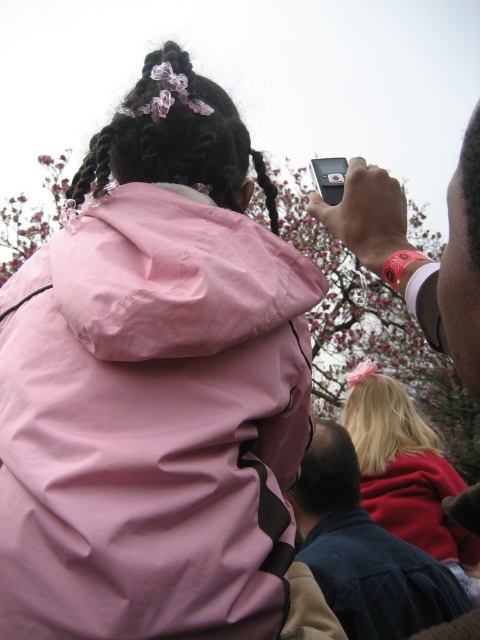
Can you confirm if blue denim jacket at lower right is positioned above pink fabric braids at upper center?

No, blue denim jacket at lower right is not above pink fabric braids at upper center.

Does blue denim jacket at lower right have a smaller size compared to pink fabric braids at upper center?

No, blue denim jacket at lower right is not smaller than pink fabric braids at upper center.

Does point (410, 605) come behind point (66, 205)?

Yes, it is.

Image resolution: width=480 pixels, height=640 pixels. Find the location of `blue denim jacket at lower right`. blue denim jacket at lower right is located at coordinates (x=363, y=550).

Is blue denim jacket at lower right taller than matte black phone at upper right?

No, blue denim jacket at lower right is not taller than matte black phone at upper right.

Does blue denim jacket at lower right lie in front of matte black phone at upper right?

No, blue denim jacket at lower right is further to the viewer.

Between point (323, 445) and point (367, 188), which one is positioned in front?

Positioned in front is point (367, 188).

At what (x,y) coordinates should I click in order to perform the action: click on blue denim jacket at lower right. Please return your answer as a coordinate pair (x, y). The height and width of the screenshot is (640, 480). Looking at the image, I should click on (363, 550).

Can you confirm if matte black phone at upper right is thinner than pink fabric braids at upper center?

In fact, matte black phone at upper right might be wider than pink fabric braids at upper center.

Can you confirm if matte black phone at upper right is bigger than pink fabric braids at upper center?

Indeed, matte black phone at upper right has a larger size compared to pink fabric braids at upper center.

What are the coordinates of `matte black phone at upper right` in the screenshot? It's located at (457, 269).

This screenshot has width=480, height=640. I want to click on matte black phone at upper right, so click(457, 269).